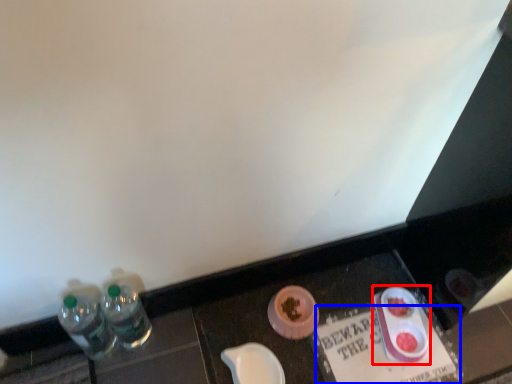
Question: Which point is further to the camera, tableware (highlighted by a red box) or writing (highlighted by a blue box)?

Choices:
 (A) tableware
 (B) writing

Answer: (A)